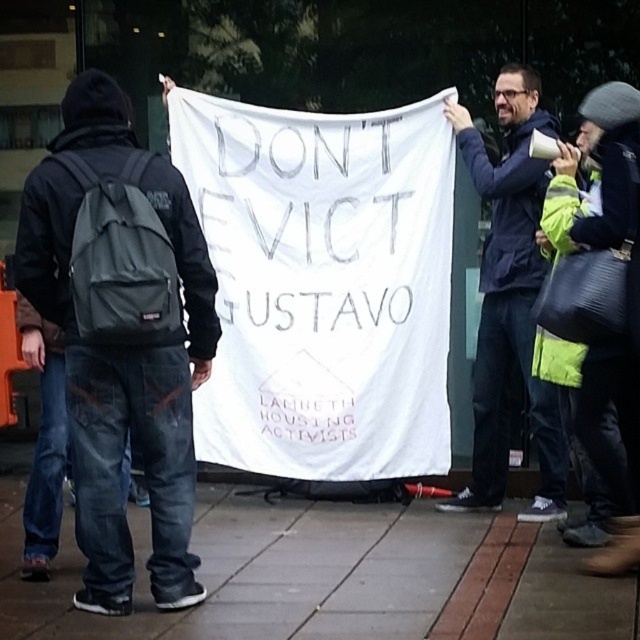
You are a photographer trying to capture a clear shot of the protest banner. You notice two people holding the banner. The person in the dark blue jacket at center and the person in the green reflective jacket at upper right. Which of these two individuals is more likely to block your view of the banner if you position yourself directly in front of the banner?

The dark blue jacket at center is more likely to block your view of the banner because it might be wider than the green reflective jacket at upper right.

You are a photographer trying to capture the protest scene. You see the dark blue jacket at center and the green reflective jacket at upper right. Which jacket is closer to the camera?

The dark blue jacket at center is closer to the camera because the green reflective jacket at upper right is behind it.